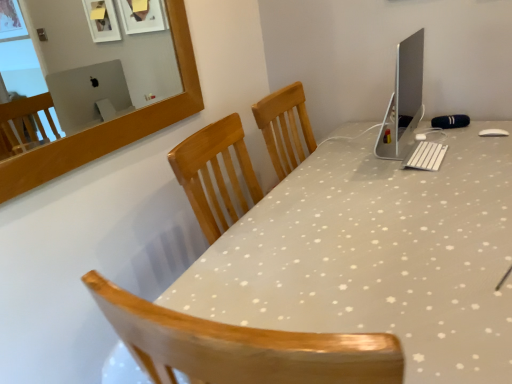
In order to face white glossy desk at center, should I rotate leftwards or rightwards?

To face it directly, rotate right by 16.146 degrees.

Image resolution: width=512 pixels, height=384 pixels. Describe the element at coordinates (403, 100) in the screenshot. I see `sleek silver monitor at upper right` at that location.

Locate an element on the screen. The width and height of the screenshot is (512, 384). white plastic keyboard at center is located at coordinates (426, 156).

Locate an element on the screen. Image resolution: width=512 pixels, height=384 pixels. white glossy desk at center is located at coordinates (376, 256).

Does point (394, 151) appear closer or farther from the camera than point (423, 151)?

Point (394, 151) appears to be farther away from the viewer than point (423, 151).

Considering the relative sizes of sleek silver monitor at upper right and white plastic keyboard at center in the image provided, is sleek silver monitor at upper right smaller than white plastic keyboard at center?

Incorrect, sleek silver monitor at upper right is not smaller in size than white plastic keyboard at center.

From the image's perspective, is sleek silver monitor at upper right above or below white plastic keyboard at center?

sleek silver monitor at upper right is situated higher than white plastic keyboard at center in the image.

Would you consider sleek silver monitor at upper right to be distant from white plastic keyboard at center?

Actually, sleek silver monitor at upper right and white plastic keyboard at center are a little close together.

From the image's perspective, is sleek silver monitor at upper right on white glossy desk at center?

Yes, from the image's perspective, sleek silver monitor at upper right is over white glossy desk at center.

Is sleek silver monitor at upper right oriented towards white glossy desk at center?

No, sleek silver monitor at upper right is not facing towards white glossy desk at center.

Which point is more forward, (407, 116) or (490, 205)?

The point (490, 205) is more forward.

Is sleek silver monitor at upper right in contact with white glossy desk at center?

sleek silver monitor at upper right and white glossy desk at center are not in contact.

Based on the photo, from a real-world perspective, who is located lower, white plastic keyboard at center or white glossy desk at center?

In real-world perspective, white glossy desk at center is lower.

The image size is (512, 384). In order to click on keyboard located behind the white glossy desk at center in this screenshot , I will do `click(426, 156)`.

From the image's perspective, does white plastic keyboard at center appear lower than white glossy desk at center?

Actually, white plastic keyboard at center appears above white glossy desk at center in the image.

Which is more to the left, white plastic keyboard at center or white glossy desk at center?

white glossy desk at center.

Can you tell me how much white plastic keyboard at center and sleek silver monitor at upper right differ in facing direction?

0.000438 degrees.

Does white plastic keyboard at center have a greater width compared to sleek silver monitor at upper right?

Yes, white plastic keyboard at center is wider than sleek silver monitor at upper right.

Is white plastic keyboard at center turned away from sleek silver monitor at upper right?

Correct, white plastic keyboard at center is looking away from sleek silver monitor at upper right.

Is the position of white plastic keyboard at center more distant than that of sleek silver monitor at upper right?

Yes, it is behind sleek silver monitor at upper right.

Can you confirm if white glossy desk at center is bigger than sleek silver monitor at upper right?

Correct, white glossy desk at center is larger in size than sleek silver monitor at upper right.

From a real-world perspective, is white glossy desk at center positioned under sleek silver monitor at upper right based on gravity?

Yes.

Between white glossy desk at center and sleek silver monitor at upper right, which one has less height?

sleek silver monitor at upper right is shorter.

What's the angular difference between white glossy desk at center and sleek silver monitor at upper right's facing directions?

There is a 90-degree angle between the facing directions of white glossy desk at center and sleek silver monitor at upper right.

Looking at this image, can you confirm if white glossy desk at center is wider than white plastic keyboard at center?

Correct, the width of white glossy desk at center exceeds that of white plastic keyboard at center.

Would you say white glossy desk at center is outside white plastic keyboard at center?

That's correct, white glossy desk at center is outside of white plastic keyboard at center.

Does white glossy desk at center appear on the right side of white plastic keyboard at center?

No.

Is white glossy desk at center oriented towards white plastic keyboard at center?

No.

Where is `keyboard behind the sleek silver monitor at upper right`? The height and width of the screenshot is (384, 512). keyboard behind the sleek silver monitor at upper right is located at coordinates (426, 156).

You are a GUI agent. You are given a task and a screenshot of the screen. Output one action in this format:
    pyautogui.click(x=<x>, y=<y>)
    Task: Click on the desk that appears below the sleek silver monitor at upper right (from a real-world perspective)
    This screenshot has height=384, width=512.
    Given the screenshot: What is the action you would take?
    pyautogui.click(x=376, y=256)

Looking at the image, which one is located further to white glossy desk at center, sleek silver monitor at upper right or white plastic keyboard at center?

sleek silver monitor at upper right.

From the image, which object appears to be nearer to white plastic keyboard at center, sleek silver monitor at upper right or white glossy desk at center?

sleek silver monitor at upper right.

Based on their spatial positions, is white glossy desk at center or sleek silver monitor at upper right further from white plastic keyboard at center?

white glossy desk at center is positioned further to the anchor white plastic keyboard at center.

Looking at the image, which one is located further to white glossy desk at center, white plastic keyboard at center or sleek silver monitor at upper right?

The object further to white glossy desk at center is sleek silver monitor at upper right.

From the image, which object appears to be farther from sleek silver monitor at upper right, white plastic keyboard at center or white glossy desk at center?

white glossy desk at center lies further to sleek silver monitor at upper right than the other object.

Estimate the real-world distances between objects in this image. Which object is further from sleek silver monitor at upper right, white glossy desk at center or white plastic keyboard at center?

Result: white glossy desk at center lies further to sleek silver monitor at upper right than the other object.

The height and width of the screenshot is (384, 512). Find the location of `computer monitor between white glossy desk at center and white plastic keyboard at center in the front-back direction`. computer monitor between white glossy desk at center and white plastic keyboard at center in the front-back direction is located at coordinates (403, 100).